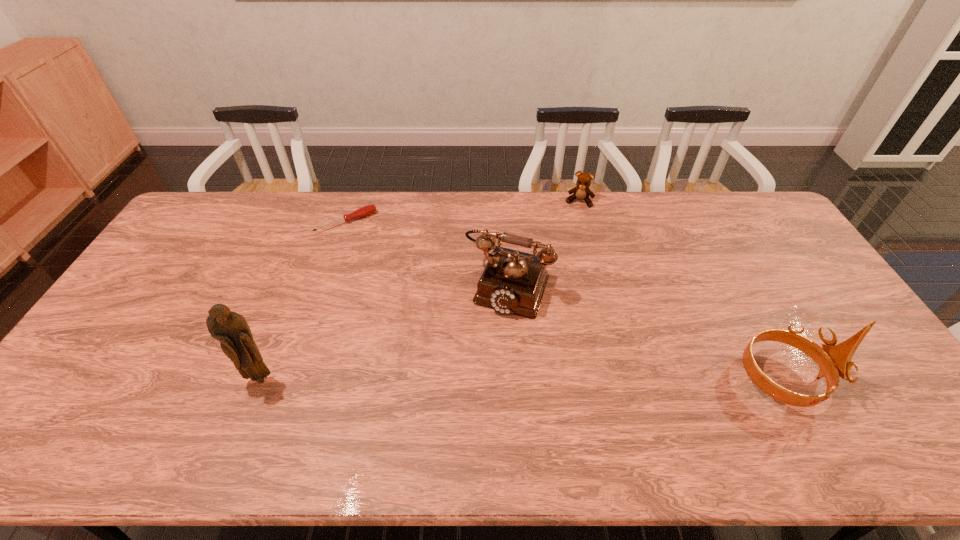
At what (x,y) coordinates should I click in order to perform the action: click on blank region between the fourth tallest object and the third nearest object. Please return your answer as a coordinate pair (x, y). Looking at the image, I should click on (543, 244).

The height and width of the screenshot is (540, 960). What are the coordinates of `free point between the third farthest object and the rightmost object` in the screenshot? It's located at (645, 332).

Where is `vacant region between the teddy bear and the shortest object`? The image size is (960, 540). vacant region between the teddy bear and the shortest object is located at coordinates (463, 212).

Find the location of a particular element. The height and width of the screenshot is (540, 960). vacant space that is in between the tallest object and the rightmost object is located at coordinates (521, 379).

Where is `empty space that is in between the figurine and the teddy bear`? This screenshot has width=960, height=540. empty space that is in between the figurine and the teddy bear is located at coordinates (420, 290).

The height and width of the screenshot is (540, 960). Find the location of `vacant region between the third object from right to left and the screwdriver`. vacant region between the third object from right to left and the screwdriver is located at coordinates (427, 254).

Locate an element on the screen. vacant space that is in between the screwdriver and the third nearest object is located at coordinates (427, 254).

The height and width of the screenshot is (540, 960). Find the location of `unoccupied position between the fourth nearest object and the second shortest object`. unoccupied position between the fourth nearest object and the second shortest object is located at coordinates (463, 212).

In order to click on unoccupied area between the teddy bear and the tallest object in this screenshot , I will do `click(420, 290)`.

Where is `object that is the second nearest to the telephone`? The height and width of the screenshot is (540, 960). object that is the second nearest to the telephone is located at coordinates (366, 210).